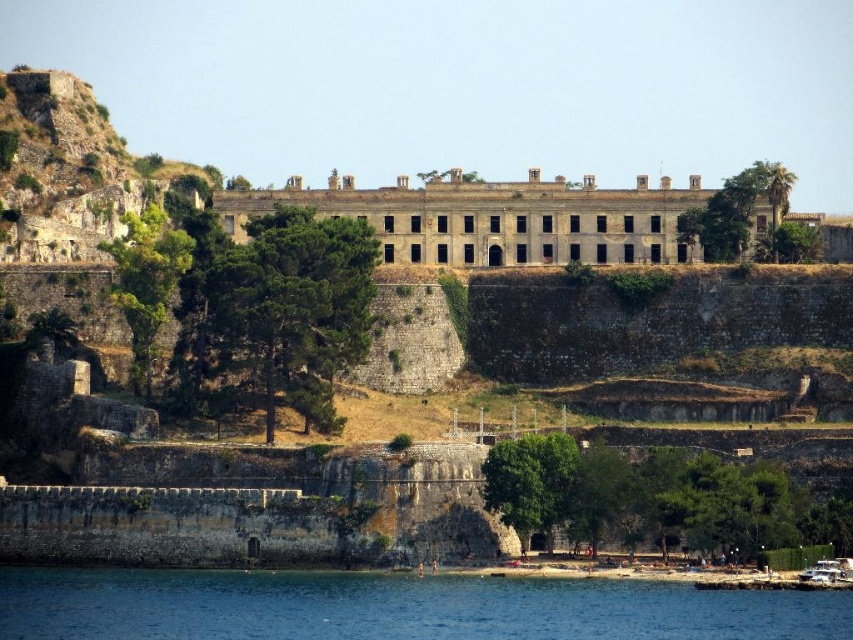
You are a visitor standing on the hill and looking at the clear blue water at lower left and the gray stone building at center. Which one takes up more area in the image?

The gray stone building at center occupies more space than the clear blue water at lower left according to the description.

You are standing on the hill and see the clear blue water at lower left and the gray stone building at center. Which object is located to the left of the other?

The clear blue water at lower left is positioned on the left side of gray stone building at center.

You are standing on the hill near the gray stone building at center and want to get to the clear blue water at lower left. Which direction should you walk to reach the water?

You should walk towards the lower left direction because the clear blue water at lower left is in front of the gray stone building at center, meaning it is closer to you in that direction.